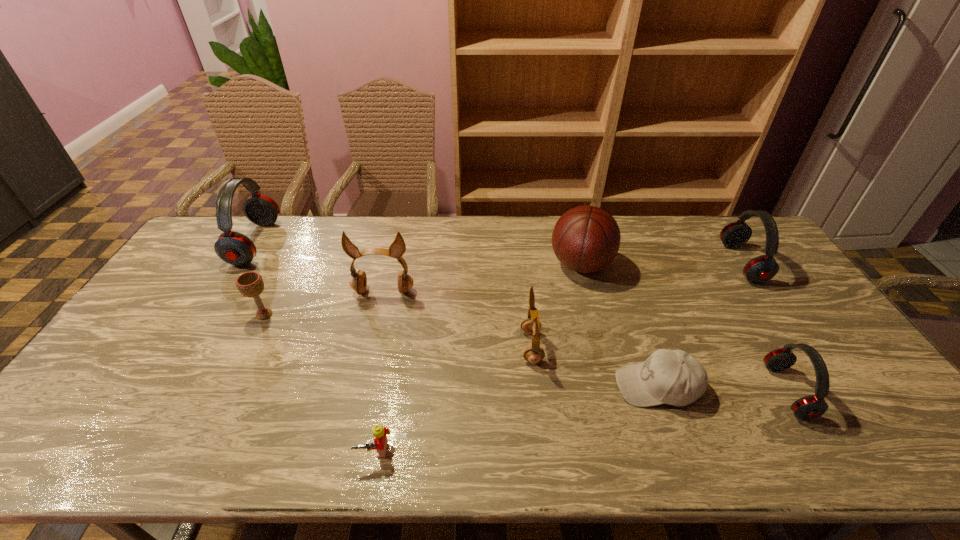
Locate an element on the screen. This screenshot has width=960, height=540. the leftmost red earphone is located at coordinates (234, 248).

Identify the location of the leftmost object. The width and height of the screenshot is (960, 540). (234, 248).

Where is `the left brown earphone`? This screenshot has width=960, height=540. the left brown earphone is located at coordinates (358, 282).

Where is `the second earphone from left to right`? The width and height of the screenshot is (960, 540). the second earphone from left to right is located at coordinates (358, 282).

The width and height of the screenshot is (960, 540). What are the coordinates of `basketball` in the screenshot? It's located at (585, 239).

The height and width of the screenshot is (540, 960). I want to click on the second smallest red earphone, so click(760, 269).

Where is `the rightmost object`? the rightmost object is located at coordinates (x=760, y=269).

In order to click on the nearer brown earphone in this screenshot , I will do `click(531, 325)`.

This screenshot has height=540, width=960. In order to click on the right brown earphone in this screenshot , I will do `click(531, 325)`.

I want to click on the shortest earphone, so click(809, 407).